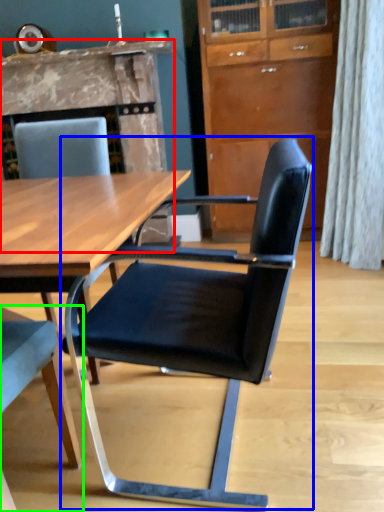
Question: Which is farther away from fireplace (highlighted by a red box)? chair (highlighted by a blue box) or chair (highlighted by a green box)?

Choices:
 (A) chair
 (B) chair

Answer: (B)